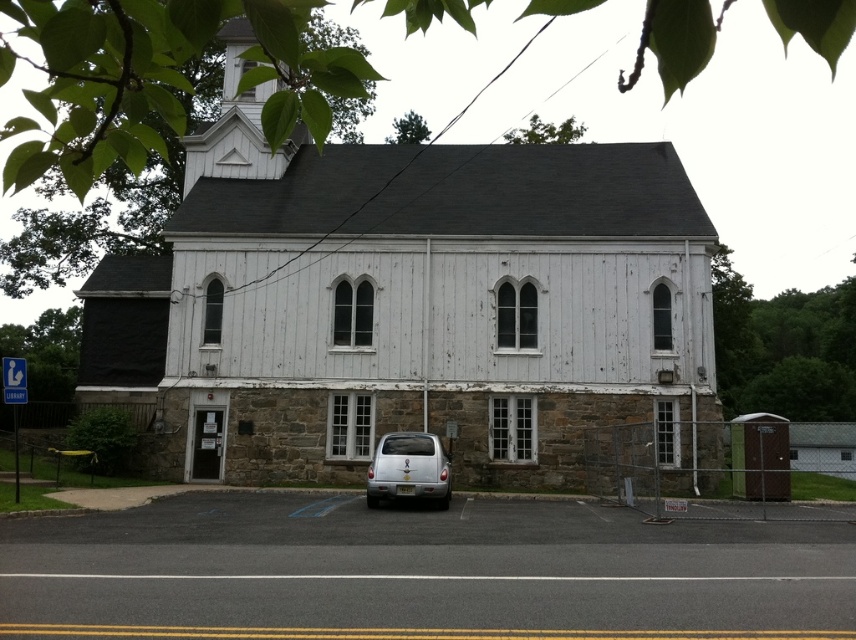
Can you confirm if white wood chapel at center is bigger than silver metallic car at center?

Correct, white wood chapel at center is larger in size than silver metallic car at center.

Between white wood chapel at center and silver metallic car at center, which one is positioned higher?

Positioned higher is white wood chapel at center.

This screenshot has width=856, height=640. I want to click on white wood chapel at center, so click(x=405, y=301).